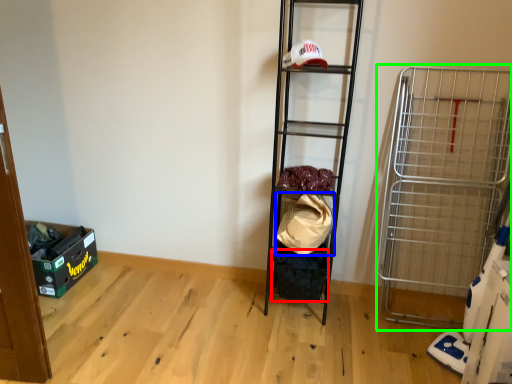
Question: Which object is positioned closest to storage box (highlighted by a red box)? Select from material (highlighted by a blue box) and cart (highlighted by a green box).

Choices:
 (A) material
 (B) cart

Answer: (A)